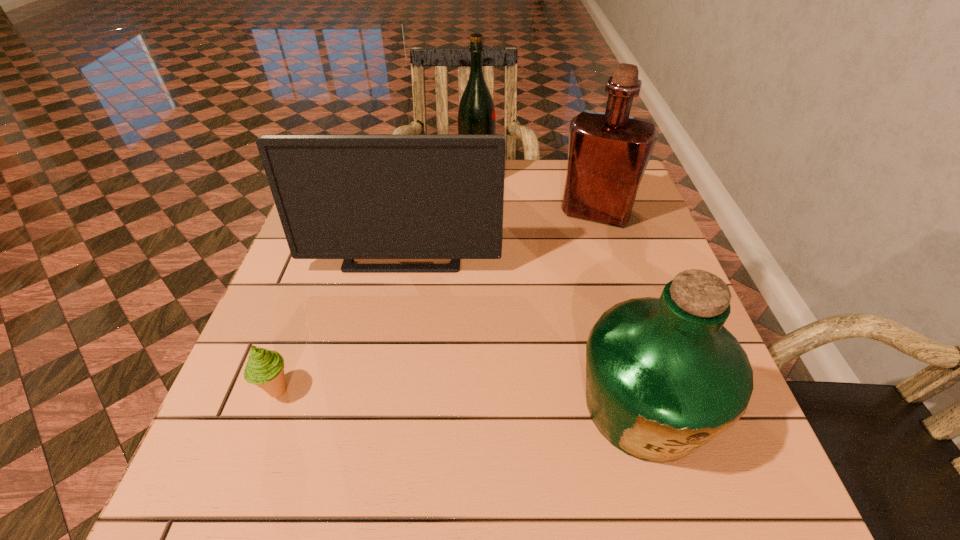
Find the location of `free space between the nearest liquor and the computer monitor`. free space between the nearest liquor and the computer monitor is located at coordinates (524, 328).

Where is `blank region between the shortest object and the second nearest liquor`? This screenshot has width=960, height=540. blank region between the shortest object and the second nearest liquor is located at coordinates (437, 301).

The width and height of the screenshot is (960, 540). In order to click on vacant area that lies between the second nearest liquor and the leftmost liquor in this screenshot , I will do `click(537, 195)`.

You are a GUI agent. You are given a task and a screenshot of the screen. Output one action in this format:
    pyautogui.click(x=<x>, y=<y>)
    Task: Click on the free area in between the shortest object and the computer monitor
    The height and width of the screenshot is (540, 960).
    Given the screenshot: What is the action you would take?
    pyautogui.click(x=341, y=320)

At what (x,y) coordinates should I click in order to perform the action: click on free space between the farthest liquor and the second farthest liquor. Please return your answer as a coordinate pair (x, y). Looking at the image, I should click on (537, 195).

I want to click on vacant region between the second farthest liquor and the farthest liquor, so click(x=537, y=195).

Where is `vacant space that is in between the nearest liquor and the farthest liquor`? Image resolution: width=960 pixels, height=540 pixels. vacant space that is in between the nearest liquor and the farthest liquor is located at coordinates (561, 293).

You are a GUI agent. You are given a task and a screenshot of the screen. Output one action in this format:
    pyautogui.click(x=<x>, y=<y>)
    Task: Click on the object that stands as the fourth closest to the icecream
    The image size is (960, 540).
    Given the screenshot: What is the action you would take?
    pyautogui.click(x=608, y=153)

Point out which object is positioned as the third nearest to the leftmost liquor. Please provide its 2D coordinates. Your answer should be formatted as a tuple, i.e. [(x, y)], where the tuple contains the x and y coordinates of a point satisfying the conditions above.

[(664, 377)]

Locate which liquor ranks in proximity to the computer monitor. Please provide its 2D coordinates. Your answer should be formatted as a tuple, i.e. [(x, y)], where the tuple contains the x and y coordinates of a point satisfying the conditions above.

[(608, 153)]